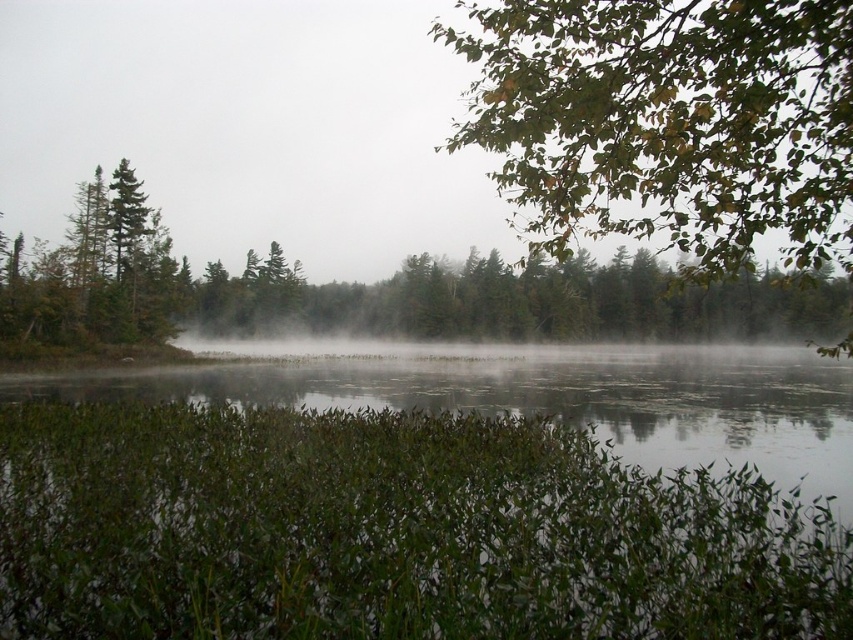
Between point (268, 284) and point (505, 356), which one is positioned behind?

Positioned behind is point (268, 284).

Is point (61, 248) more distant than point (306, 365)?

No, it is not.

Locate an element on the screen. green matte tree at upper center is located at coordinates (370, 291).

Which is in front, point (695, 22) or point (360, 392)?

Point (695, 22)

Does green leafy branch at upper right have a lesser width compared to green leafy vegetation at lower center?

Yes, green leafy branch at upper right is thinner than green leafy vegetation at lower center.

Which is in front, point (492, 26) or point (722, 346)?

Point (492, 26)

Where is `green leafy branch at upper right`? The image size is (853, 640). green leafy branch at upper right is located at coordinates (668, 122).

Does green leafy branch at upper right appear on the right side of green matte tree at upper center?

Yes, green leafy branch at upper right is to the right of green matte tree at upper center.

Which of these two, green leafy branch at upper right or green matte tree at upper center, stands shorter?

green matte tree at upper center is shorter.

You are a GUI agent. You are given a task and a screenshot of the screen. Output one action in this format:
    pyautogui.click(x=<x>, y=<y>)
    Task: Click on the green leafy branch at upper right
    
    Given the screenshot: What is the action you would take?
    pyautogui.click(x=668, y=122)

At what (x,y) coordinates should I click in order to perform the action: click on green leafy branch at upper right. Please return your answer as a coordinate pair (x, y). Looking at the image, I should click on (668, 122).